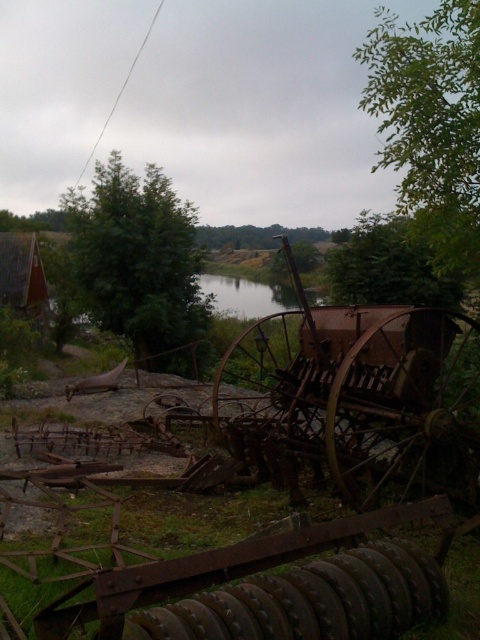
You are standing in the rural scene and want to determine which tree is nearer to you. You see the green leafy tree at upper right and the green matte tree at upper right. Which one is closer?

The green leafy tree at upper right is closer to the viewer than the green matte tree at upper right.

You are standing at the center of the image and looking towards the green leafy tree at upper right and the green leafy tree at upper left. Which tree is closer to your left side?

The green leafy tree at upper left is closer to your left side because it is positioned to the left of the green leafy tree at upper right.